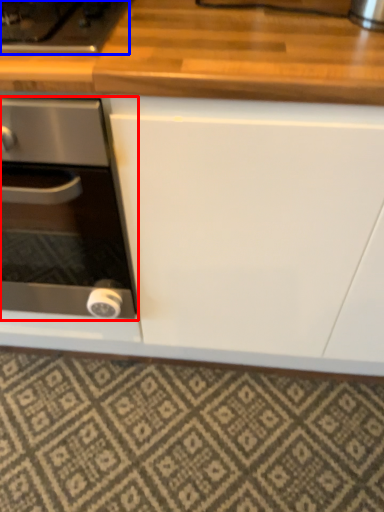
Question: Which point is closer to the camera, kitchen appliance (highlighted by a red box) or gas stove (highlighted by a blue box)?

Choices:
 (A) kitchen appliance
 (B) gas stove

Answer: (A)